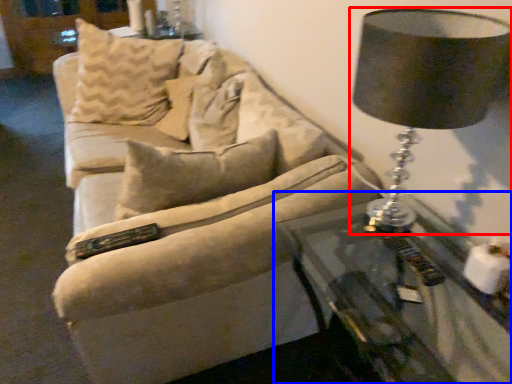
Question: Which of the following is the closest to the observer, lamp (highlighted by a red box) or table (highlighted by a blue box)?

Choices:
 (A) lamp
 (B) table

Answer: (B)